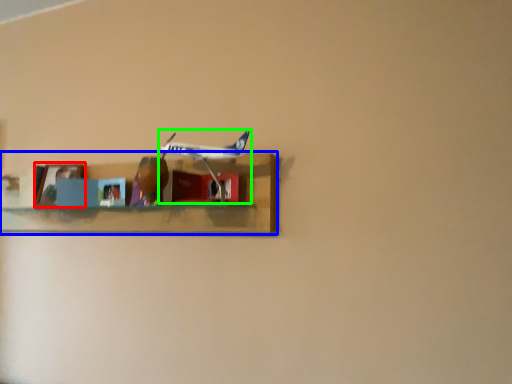
Question: Which object is the closest to the picture frame (highlighted by a red box)? Choose among these: shelf (highlighted by a blue box) or airplane (highlighted by a green box).

Choices:
 (A) shelf
 (B) airplane

Answer: (A)